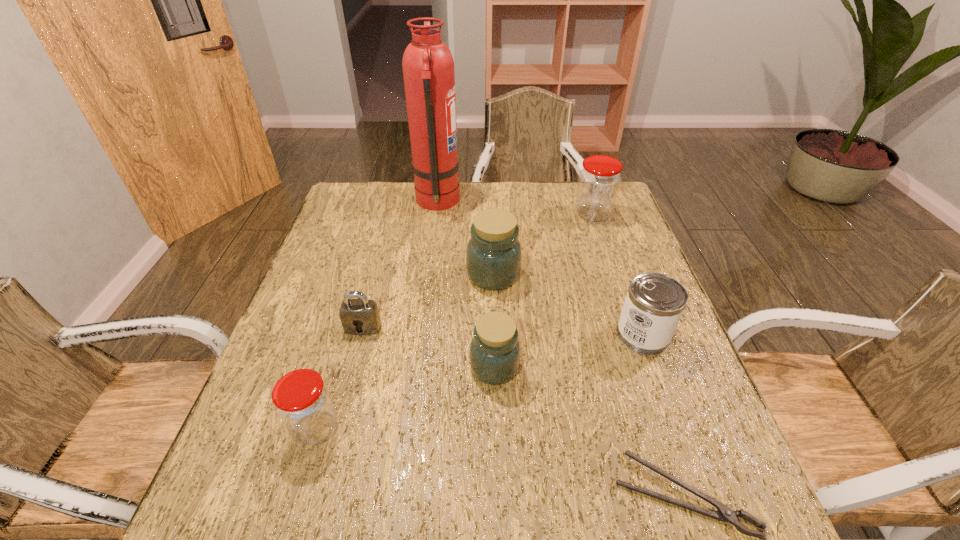
You are a GUI agent. You are given a task and a screenshot of the screen. Output one action in this format:
    pyautogui.click(x=<x>, y=<y>)
    Task: Click on the fire extinguisher
    The height and width of the screenshot is (540, 960).
    Given the screenshot: What is the action you would take?
    pyautogui.click(x=428, y=67)

Find the location of `the tallest object`. the tallest object is located at coordinates (428, 67).

I want to click on the right red jar, so click(599, 180).

Where is `the farthest jar`? the farthest jar is located at coordinates (599, 180).

The height and width of the screenshot is (540, 960). In order to click on the second farthest jar in this screenshot , I will do pyautogui.click(x=493, y=258).

The image size is (960, 540). I want to click on the farther green jar, so click(x=493, y=258).

Where is `can`? This screenshot has height=540, width=960. can is located at coordinates (654, 304).

Where is `the second nearest jar`? The height and width of the screenshot is (540, 960). the second nearest jar is located at coordinates (494, 354).

I want to click on the nearer green jar, so click(x=494, y=354).

You are a GUI agent. You are given a task and a screenshot of the screen. Output one action in this format:
    pyautogui.click(x=<x>, y=<y>)
    Task: Click on the left red jar
    This screenshot has height=540, width=960.
    Given the screenshot: What is the action you would take?
    pyautogui.click(x=302, y=400)